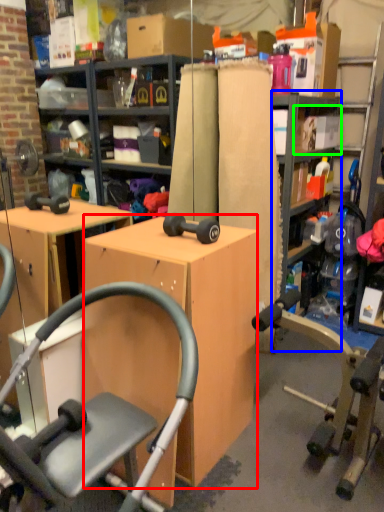
Question: Which is farther away from desk (highlighted by a red box)? bookshelf (highlighted by a blue box) or shelf (highlighted by a green box)?

Choices:
 (A) bookshelf
 (B) shelf

Answer: (B)